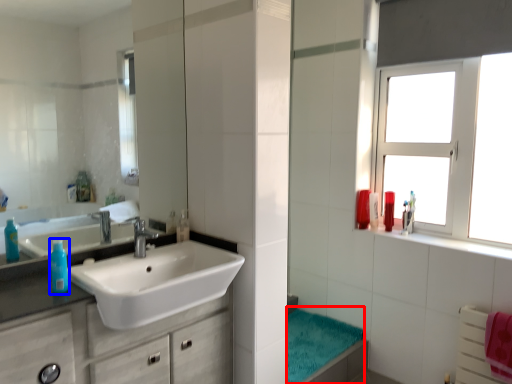
Question: Which object is closer to the camera taking this photo, bath towel (highlighted by a red box) or turquoise (highlighted by a blue box)?

Choices:
 (A) bath towel
 (B) turquoise

Answer: (B)